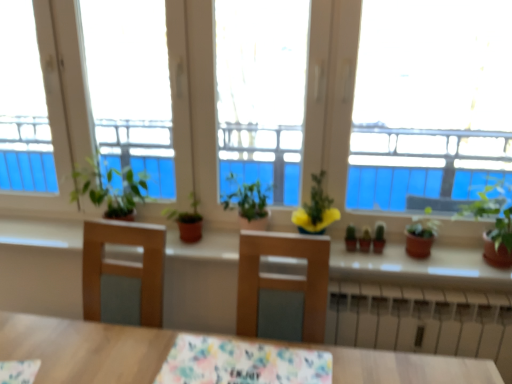
Where is `empty space that is to the right of matte brown pot at right, which is the second houseplant from right to left`? Image resolution: width=512 pixels, height=384 pixels. empty space that is to the right of matte brown pot at right, which is the second houseplant from right to left is located at coordinates (461, 251).